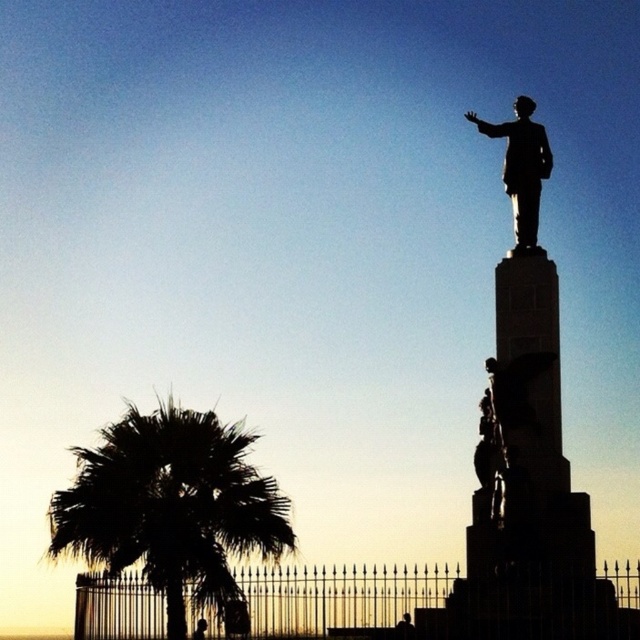
You are standing in front of the statue and want to take a photo of both the black leafy palm tree at lower left and the polished bronze statue at upper right. Which object will appear larger in the photo?

The black leafy palm tree at lower left will appear larger in the photo because it is closer to the viewer than the polished bronze statue at upper right.

You are an architect designing a new garden layout. You need to place a new bench between the black leafy palm tree at lower left and the polished bronze statue at upper right. Given that the palm tree is taller than the statue, which object should you consider for shade placement to ensure the bench is shaded during midday?

The black leafy palm tree at lower left is taller than the polished bronze statue at upper right. Therefore, placing the bench under the palm tree would provide better shade during midday as it has a larger canopy due to its height.

You are an artist planning to paint this scene. You want to ensure that the black leafy palm tree at lower left and the polished bronze statue at upper right are proportionally accurate. Based on their sizes in the image, which object should you draw larger in your painting?

The black leafy palm tree at lower left should be drawn larger than the polished bronze statue at upper right because it is larger in size according to the description.